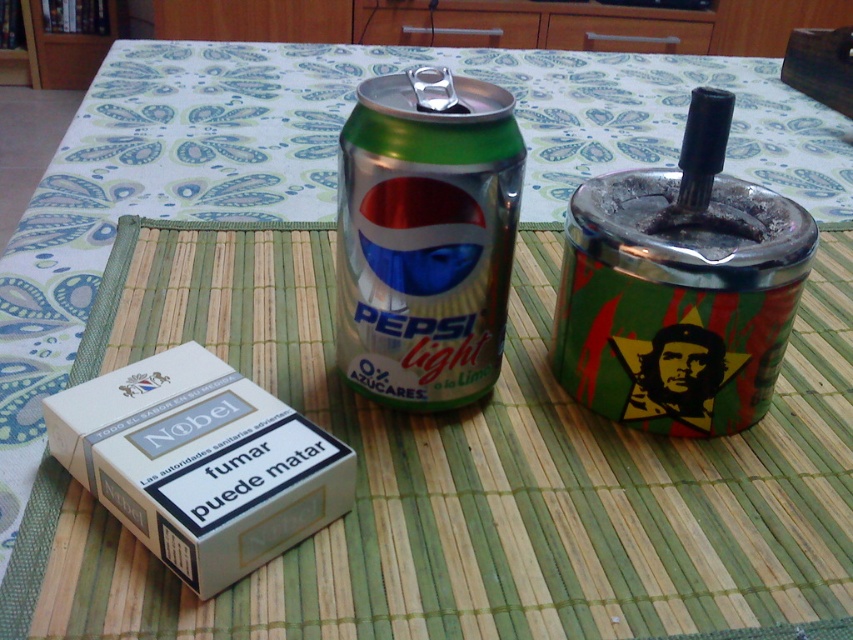
Consider the image. Is metallic ashtray at right smaller than metallic silver can at center?

No.

The width and height of the screenshot is (853, 640). What do you see at coordinates (679, 288) in the screenshot? I see `metallic ashtray at right` at bounding box center [679, 288].

Is point (695, 289) more distant than point (457, 353)?

No, (695, 289) is in front of (457, 353).

Identify the location of metallic ashtray at right. This screenshot has height=640, width=853. (679, 288).

Does metallic ashtray at right appear over white matte cigarette box at lower left?

Yes.

Does point (706, 326) come farther from viewer compared to point (190, 518)?

Yes, it is behind point (190, 518).

Locate an element on the screen. metallic ashtray at right is located at coordinates (679, 288).

Can you confirm if metallic silver can at center is positioned below white matte cigarette box at lower left?

No, metallic silver can at center is not below white matte cigarette box at lower left.

Does metallic silver can at center have a greater height compared to white matte cigarette box at lower left?

Yes, metallic silver can at center is taller than white matte cigarette box at lower left.

Does point (445, 400) come behind point (225, 435)?

Yes, point (445, 400) is behind point (225, 435).

Image resolution: width=853 pixels, height=640 pixels. I want to click on metallic silver can at center, so click(x=425, y=236).